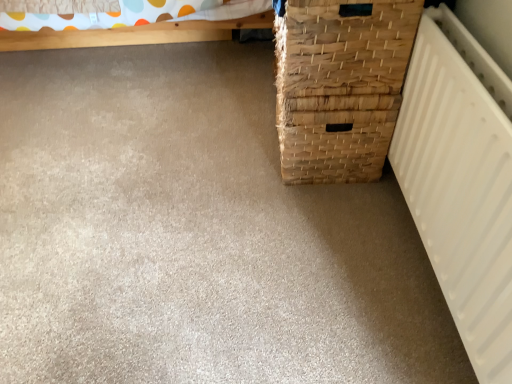
Question: Is natural woven basket at right facing away from white matte radiator at right?

Choices:
 (A) yes
 (B) no

Answer: (B)

Question: Can we say natural woven basket at right lies outside white matte radiator at right?

Choices:
 (A) no
 (B) yes

Answer: (B)

Question: From the image's perspective, does natural woven basket at right appear lower than white matte radiator at right?

Choices:
 (A) yes
 (B) no

Answer: (B)

Question: Does natural woven basket at right have a larger size compared to white matte radiator at right?

Choices:
 (A) no
 (B) yes

Answer: (B)

Question: Is natural woven basket at right next to white matte radiator at right and touching it?

Choices:
 (A) yes
 (B) no

Answer: (B)

Question: From the image's perspective, is natural woven basket at right on top of white matte radiator at right?

Choices:
 (A) no
 (B) yes

Answer: (B)

Question: From the image's perspective, is white matte radiator at right above natural woven basket at right?

Choices:
 (A) no
 (B) yes

Answer: (A)

Question: Is white matte radiator at right surrounding natural woven basket at right?

Choices:
 (A) yes
 (B) no

Answer: (B)

Question: Considering the relative sizes of white matte radiator at right and natural woven basket at right in the image provided, is white matte radiator at right taller than natural woven basket at right?

Choices:
 (A) no
 (B) yes

Answer: (B)

Question: Is white matte radiator at right to the right of natural woven basket at right from the viewer's perspective?

Choices:
 (A) no
 (B) yes

Answer: (B)

Question: Does white matte radiator at right appear on the left side of natural woven basket at right?

Choices:
 (A) no
 (B) yes

Answer: (A)

Question: Is white matte radiator at right in front of natural woven basket at right?

Choices:
 (A) no
 (B) yes

Answer: (B)

Question: From their relative heights in the image, would you say white matte radiator at right is taller or shorter than natural woven basket at right?

Choices:
 (A) tall
 (B) short

Answer: (A)